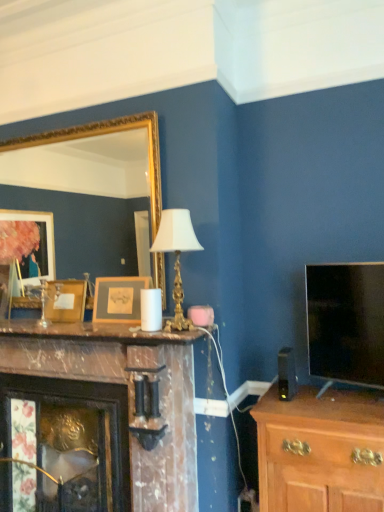
Question: Considering the positions of marble fireplace at center and flat-screen tv at right in the image, is marble fireplace at center wider or thinner than flat-screen tv at right?

Choices:
 (A) wide
 (B) thin

Answer: (A)

Question: Is point (193, 332) closer or farther from the camera than point (369, 284)?

Choices:
 (A) closer
 (B) farther

Answer: (B)

Question: Which object is positioned farthest from the wooden picture frame at center-left, acting as the second picture frame starting from the right?

Choices:
 (A) wooden chest of drawers at lower right
 (B) marble fireplace at center
 (C) wooden picture frame at center, which is the 2th picture frame from left to right
 (D) gold-framed mirror at upper left
 (E) marble mantel at center

Answer: (A)

Question: Which object is positioned farthest from the wooden picture frame at center-left, acting as the 1th picture frame starting from the back?

Choices:
 (A) wooden picture frame at center, the second picture frame positioned from the back
 (B) marble fireplace at center
 (C) flat-screen tv at right
 (D) wooden chest of drawers at lower right
 (E) marble mantel at center

Answer: (C)